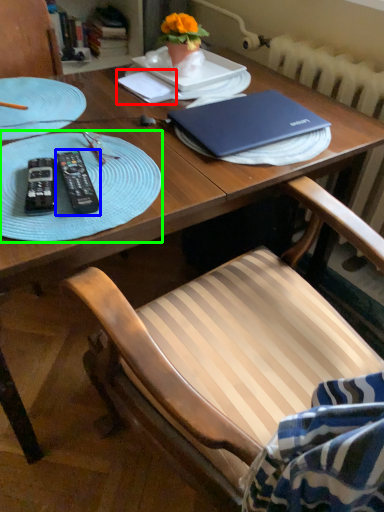
Question: Estimate the real-world distances between objects in this image. Which object is farther from notepad (highlighted by a red box), remote control (highlighted by a blue box) or glass plate (highlighted by a green box)?

Choices:
 (A) remote control
 (B) glass plate

Answer: (A)